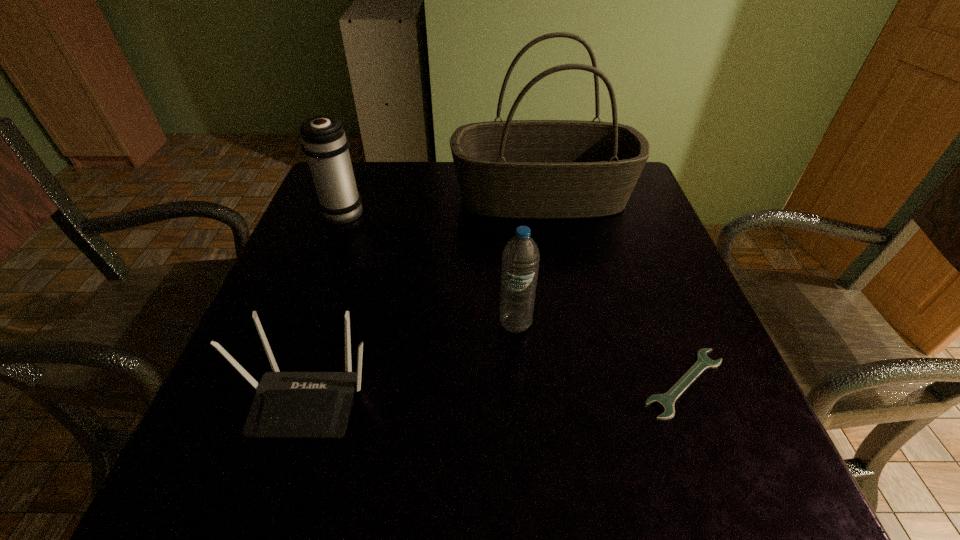
I want to click on object located at the near left corner, so (286, 404).

Image resolution: width=960 pixels, height=540 pixels. In order to click on object that is at the far right corner in this screenshot , I will do `click(526, 169)`.

Where is `free location at the far edge of the desktop`? The image size is (960, 540). free location at the far edge of the desktop is located at coordinates (431, 170).

Identify the location of blank space at the near edge of the desktop. (530, 446).

In the image, there is a desktop. Where is `free space at the right edge`? This screenshot has width=960, height=540. free space at the right edge is located at coordinates (628, 217).

This screenshot has width=960, height=540. I want to click on vacant space at the far left corner, so click(x=374, y=182).

Locate an element on the screen. unoccupied area between the thermos bottle and the fourth tallest object is located at coordinates (326, 303).

Where is `free spot between the shortest object and the water bottle`? free spot between the shortest object and the water bottle is located at coordinates (600, 354).

Identify the location of free space between the water bottle and the wrench. (600, 354).

Identify the location of free area in between the tallest object and the thermos bottle. (444, 204).